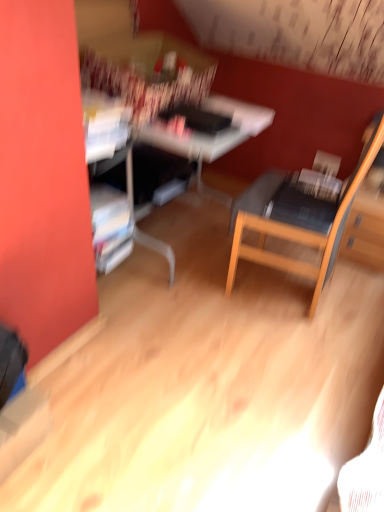
Question: Is white glossy computer desk at center far from wooden chair at center-right?

Choices:
 (A) yes
 (B) no

Answer: (B)

Question: From a real-world perspective, is white glossy computer desk at center positioned over wooden chair at center-right based on gravity?

Choices:
 (A) no
 (B) yes

Answer: (A)

Question: Are white glossy computer desk at center and wooden chair at center-right making contact?

Choices:
 (A) yes
 (B) no

Answer: (B)

Question: Is white glossy computer desk at center to the right of wooden chair at center-right from the viewer's perspective?

Choices:
 (A) yes
 (B) no

Answer: (B)

Question: Does white glossy computer desk at center have a smaller size compared to wooden chair at center-right?

Choices:
 (A) yes
 (B) no

Answer: (B)

Question: Is white glossy computer desk at center closer to the viewer compared to wooden chair at center-right?

Choices:
 (A) yes
 (B) no

Answer: (B)

Question: From a real-world perspective, is wooden chair at center-right positioned over white glossy computer desk at center based on gravity?

Choices:
 (A) no
 (B) yes

Answer: (B)

Question: Can you confirm if wooden chair at center-right is smaller than white glossy computer desk at center?

Choices:
 (A) yes
 (B) no

Answer: (A)

Question: Is wooden chair at center-right in contact with white glossy computer desk at center?

Choices:
 (A) yes
 (B) no

Answer: (B)

Question: Is wooden chair at center-right to the left of white glossy computer desk at center from the viewer's perspective?

Choices:
 (A) no
 (B) yes

Answer: (A)

Question: Is wooden chair at center-right not inside white glossy computer desk at center?

Choices:
 (A) yes
 (B) no

Answer: (A)

Question: Considering the relative sizes of wooden chair at center-right and white glossy computer desk at center in the image provided, is wooden chair at center-right shorter than white glossy computer desk at center?

Choices:
 (A) no
 (B) yes

Answer: (A)

Question: In terms of width, does wooden chair at center-right look wider or thinner when compared to white glossy computer desk at center?

Choices:
 (A) wide
 (B) thin

Answer: (B)